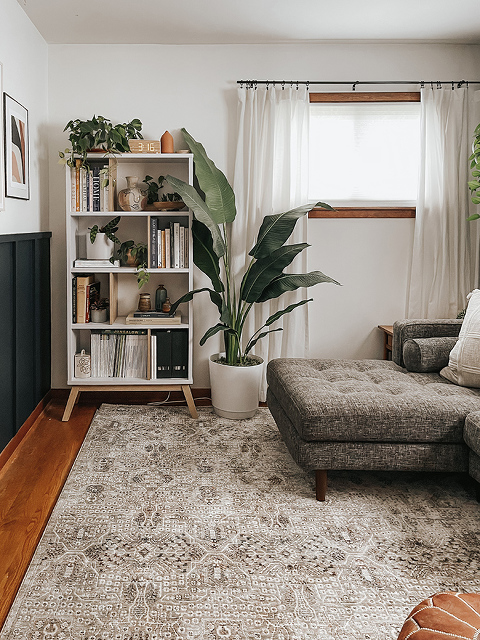
In order to click on shade in this screenshot , I will do `click(341, 198)`, `click(390, 200)`.